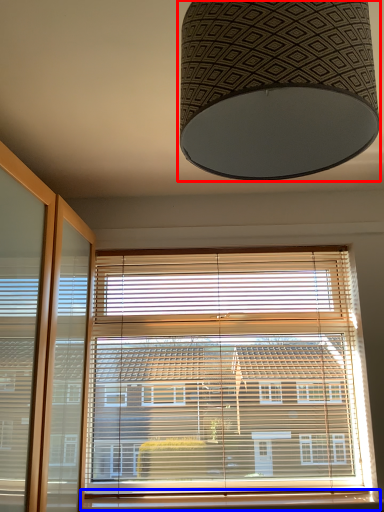
Question: Which point is closer to the camera, lamp (highlighted by a red box) or window sill (highlighted by a blue box)?

Choices:
 (A) lamp
 (B) window sill

Answer: (A)